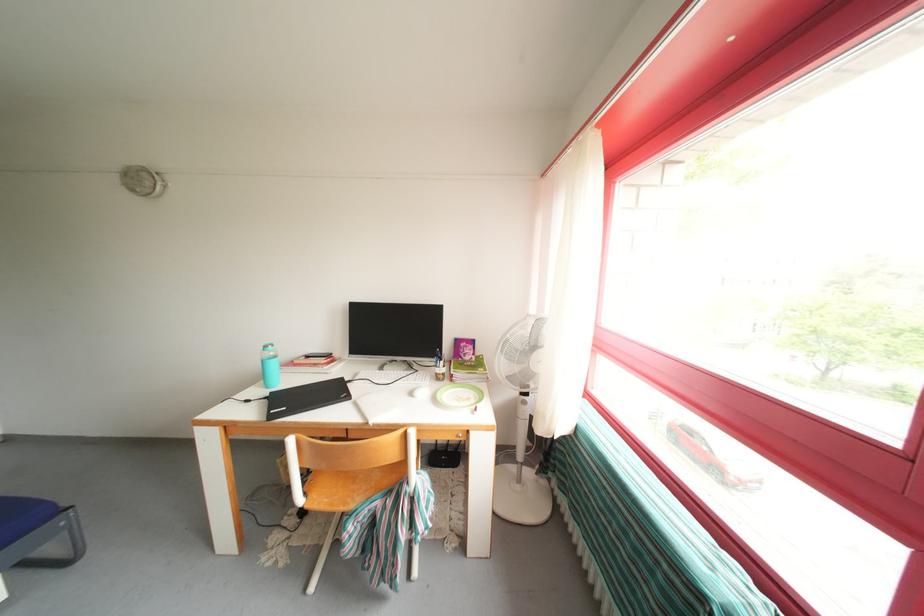
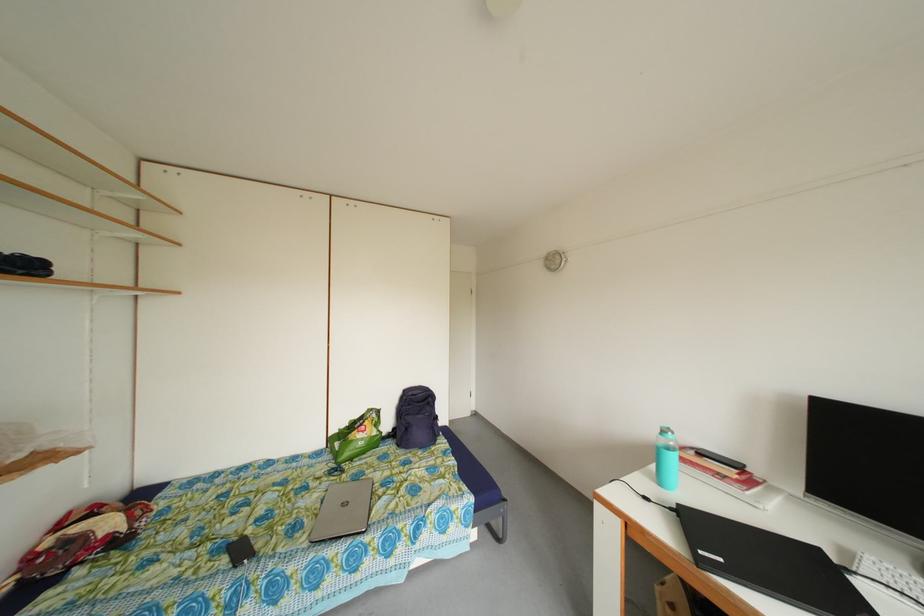
Question: Based on the continuous images, in which direction is the camera rotating? Reply with the corresponding letter.

Choices:
 (A) Left
 (B) Right
 (C) Up
 (D) Down

Answer: (A)